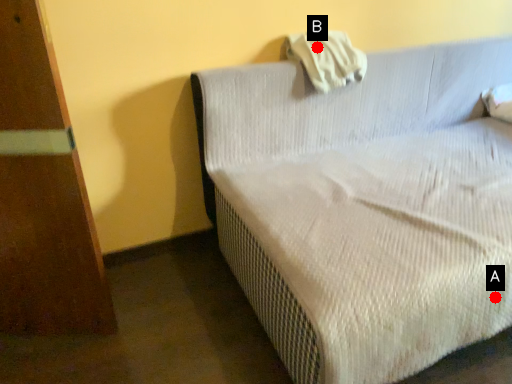
Question: Two points are circled on the image, labeled by A and B beside each circle. Which point appears farthest from the camera in this image?

Choices:
 (A) A is further
 (B) B is further

Answer: (B)